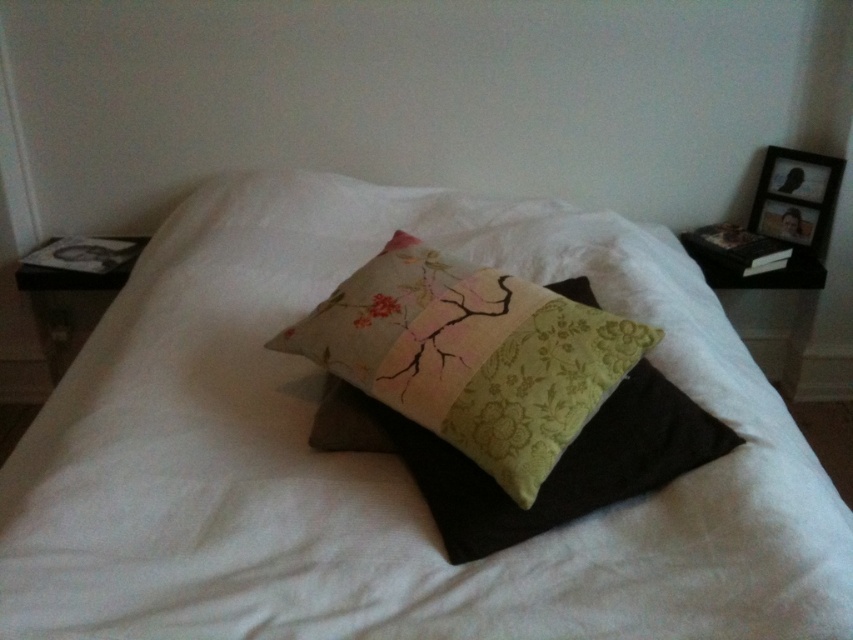
Looking at this image, you are trying to place a decorative item between the textured cotton bed at center and the patchwork fabric cushion at center. The item is 10 inches long. Will it fit in the space between them?

The space between the textured cotton bed at center and the patchwork fabric cushion at center is 9.76 inches. Since the decorative item is 10 inches long, it will not fit in the space between them.

You are standing at the foot of the bed and want to place a small vase on the nearest object. Which object should you choose between the textured cotton bed at center and the patchwork fabric cushion at center?

The textured cotton bed at center is closer to the viewer than the patchwork fabric cushion at center, so you should place the vase on the textured cotton bed at center.

You are trying to decide whether to place a small decorative box on either the textured cotton bed at center or the patchwork fabric cushion at center. Based on their heights, which surface would allow the box to be more visible from the foot of the bed?

The textured cotton bed at center has a greater height compared to the patchwork fabric cushion at center, so placing the small decorative box on the textured cotton bed at center would make it more visible from the foot of the bed.